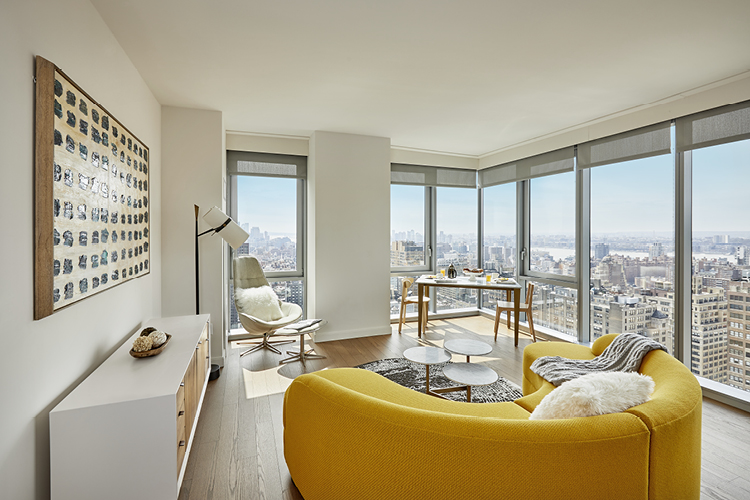
You are a GUI agent. You are given a task and a screenshot of the screen. Output one action in this format:
    pyautogui.click(x=<x>, y=<y>)
    Task: Click on the lamp
    
    Given the screenshot: What is the action you would take?
    point(225,232)